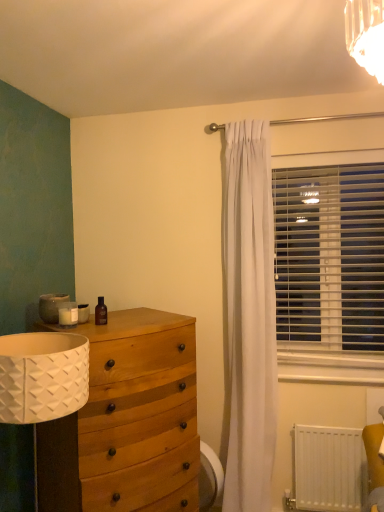
You are a GUI agent. You are given a task and a screenshot of the screen. Output one action in this format:
    pyautogui.click(x=<x>, y=<y>)
    Task: Click on the vacant space to the right of brown glass bottle at upper left
    The height and width of the screenshot is (512, 384).
    Given the screenshot: What is the action you would take?
    (x=133, y=326)